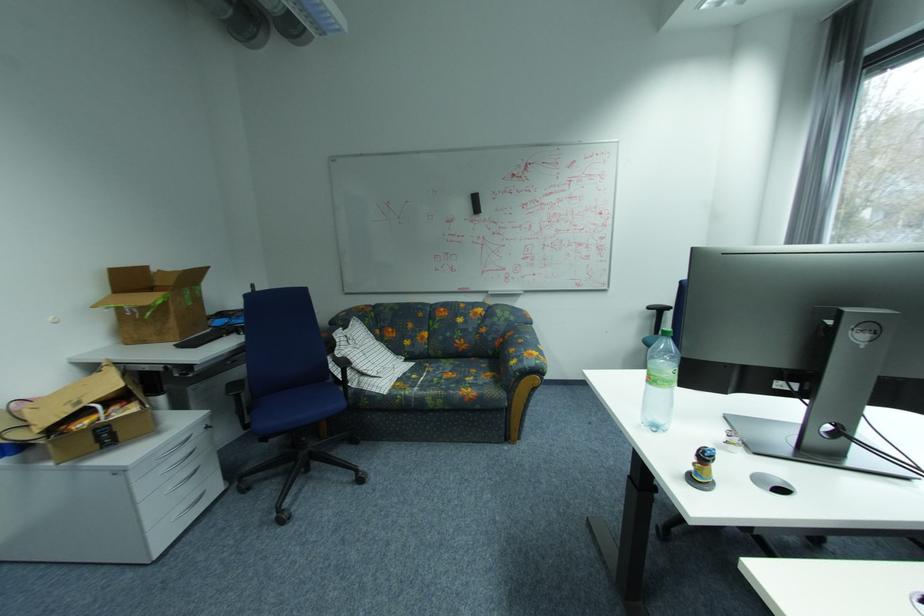
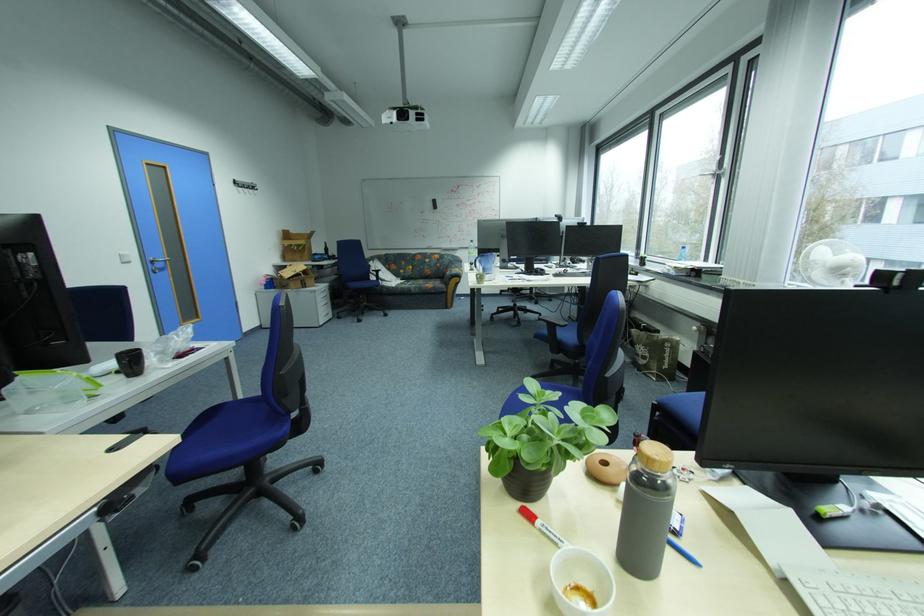
The point at [416,392] is marked in the first image. Where is the corresponding point in the second image?

(411, 286)